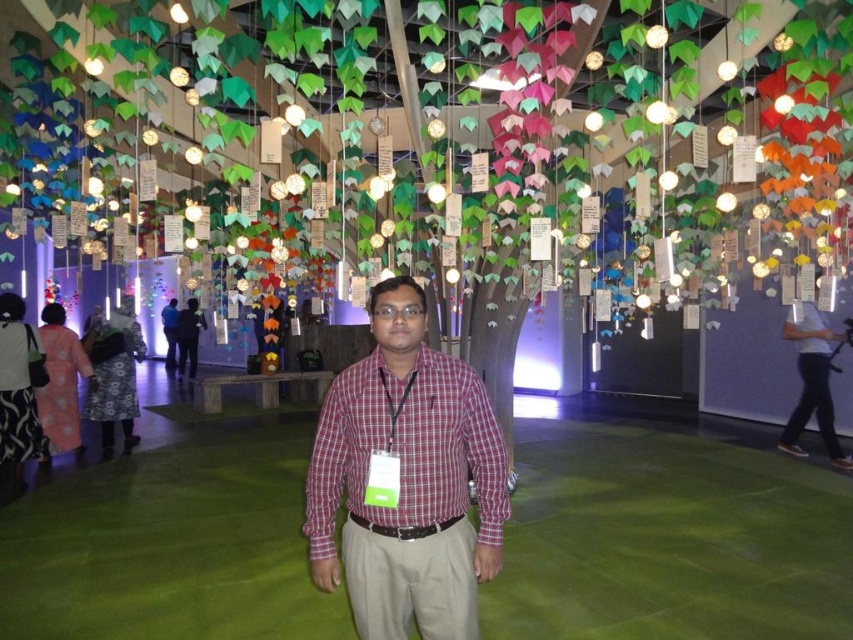
Does white cotton shirt at right appear on the right side of plaid shirt at center?

Correct, you'll find white cotton shirt at right to the right of plaid shirt at center.

What are the coordinates of `white cotton shirt at right` in the screenshot? It's located at (813, 381).

At what (x,y) coordinates should I click in order to perform the action: click on white cotton shirt at right. Please return your answer as a coordinate pair (x, y). The height and width of the screenshot is (640, 853). Looking at the image, I should click on (813, 381).

Is plaid cotton shirt at center closer to camera compared to matte black shirt at center?

Yes, plaid cotton shirt at center is in front of matte black shirt at center.

Is point (318, 417) farther from camera compared to point (190, 314)?

No.

Between point (437, 445) and point (184, 342), which one is positioned in front?

Point (437, 445)

Find the location of `plaid cotton shirt at center`. plaid cotton shirt at center is located at coordinates click(x=407, y=481).

Between white cotton shirt at right and matte black shirt at center, which one appears on the right side from the viewer's perspective?

From the viewer's perspective, white cotton shirt at right appears more on the right side.

Does white cotton shirt at right come in front of matte black shirt at center?

Yes, it is in front of matte black shirt at center.

You are a GUI agent. You are given a task and a screenshot of the screen. Output one action in this format:
    pyautogui.click(x=<x>, y=<y>)
    Task: Click on the white cotton shirt at right
    Image resolution: width=853 pixels, height=640 pixels.
    Given the screenshot: What is the action you would take?
    pyautogui.click(x=813, y=381)